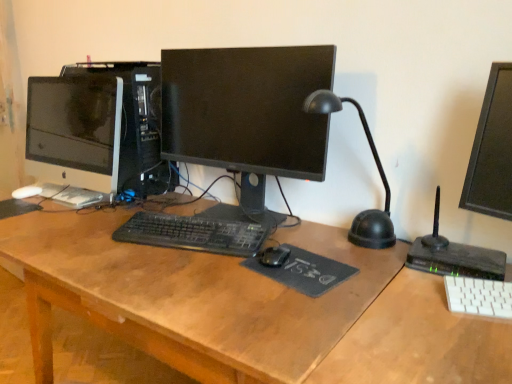
Locate an element on the screen. This screenshot has height=384, width=512. free space to the left of black matte mouse at center is located at coordinates (203, 265).